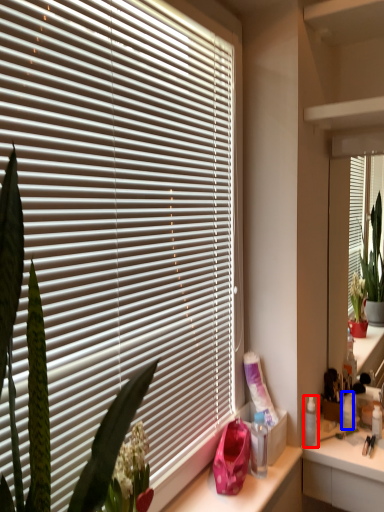
Question: Which point is further to the camera, toiletry (highlighted by a red box) or toiletry (highlighted by a blue box)?

Choices:
 (A) toiletry
 (B) toiletry

Answer: (B)